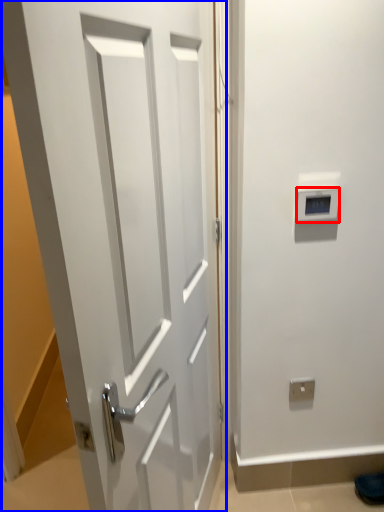
Question: Which point is closer to the camera, thermostat (highlighted by a red box) or door (highlighted by a blue box)?

Choices:
 (A) thermostat
 (B) door

Answer: (B)